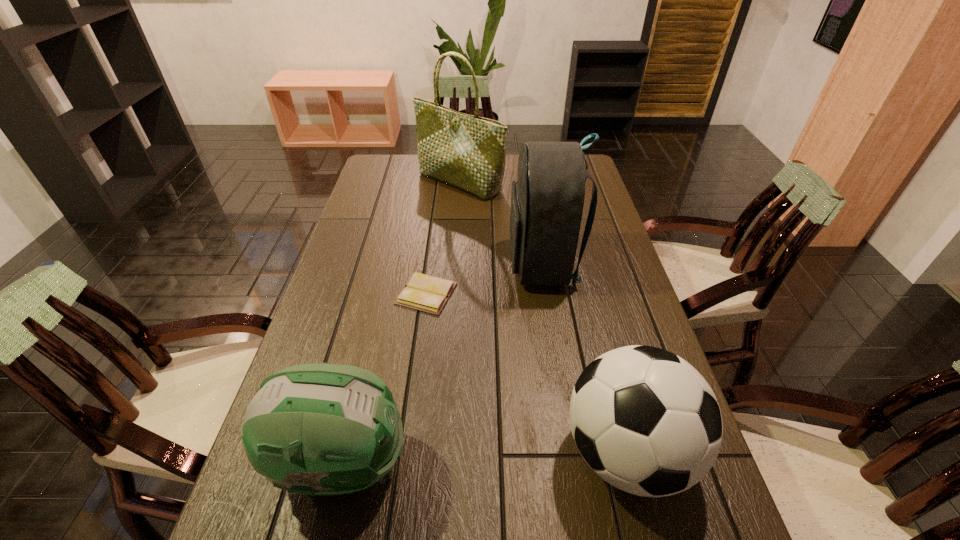
Locate an element on the screen. This screenshot has width=960, height=540. vacant space located 0.090m on the visor of the football helmet is located at coordinates (453, 463).

This screenshot has height=540, width=960. In order to click on vacant space positioned 0.210m on the right of the shortest object in this screenshot , I will do `click(530, 293)`.

At what (x,y) coordinates should I click in order to perform the action: click on object positioned at the far edge. Please return your answer as a coordinate pair (x, y). The height and width of the screenshot is (540, 960). Looking at the image, I should click on (468, 152).

Where is `object at the left edge`? This screenshot has height=540, width=960. object at the left edge is located at coordinates (312, 429).

The height and width of the screenshot is (540, 960). Find the location of `backpack at the right edge`. backpack at the right edge is located at coordinates (547, 201).

This screenshot has width=960, height=540. Identify the location of soccer ball positioned at the right edge. (646, 421).

You are a GUI agent. You are given a task and a screenshot of the screen. Output one action in this format:
    pyautogui.click(x=<x>, y=<y>)
    Task: Click on the vacant space at the far edge of the desktop
    
    Given the screenshot: What is the action you would take?
    pyautogui.click(x=509, y=166)

Where is `vacant space at the left edge of the desktop`? The image size is (960, 540). vacant space at the left edge of the desktop is located at coordinates (373, 216).

This screenshot has width=960, height=540. I want to click on free space at the right edge of the desktop, so click(633, 343).

The image size is (960, 540). Find the location of `blank space at the far left corner of the desktop`. blank space at the far left corner of the desktop is located at coordinates (401, 171).